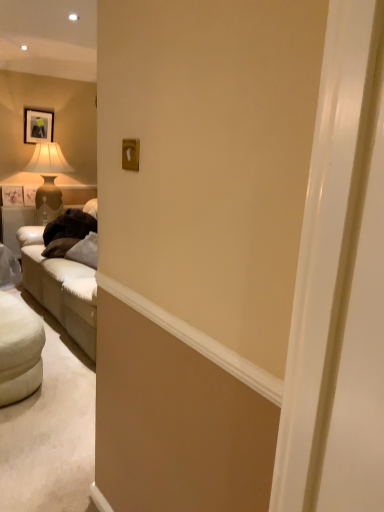
The width and height of the screenshot is (384, 512). What do you see at coordinates (48, 180) in the screenshot?
I see `matte beige lampshade at left` at bounding box center [48, 180].

Describe the element at coordinates (38, 125) in the screenshot. The height and width of the screenshot is (512, 384). I see `matte black picture frame at upper left` at that location.

Where is `matte beige lampshade at left`? matte beige lampshade at left is located at coordinates (48, 180).

Would you say matte black picture frame at upper left is a long distance from white fabric ottoman at lower left?

matte black picture frame at upper left is far away from white fabric ottoman at lower left.

Considering the positions of objects matte black picture frame at upper left and white fabric ottoman at lower left in the image provided, who is more to the left, matte black picture frame at upper left or white fabric ottoman at lower left?

Positioned to the left is matte black picture frame at upper left.

Can you confirm if matte black picture frame at upper left is thinner than white fabric ottoman at lower left?

Correct, the width of matte black picture frame at upper left is less than that of white fabric ottoman at lower left.

Looking at this image, from their relative heights in the image, would you say matte black picture frame at upper left is taller or shorter than white fabric ottoman at lower left?

Considering their sizes, matte black picture frame at upper left has more height than white fabric ottoman at lower left.

From a real-world perspective, between matte beige lampshade at left and white fabric ottoman at lower left, who is vertically lower?

In real-world perspective, white fabric ottoman at lower left is lower.

This screenshot has height=512, width=384. In order to click on table lamp above the white fabric ottoman at lower left (from a real-world perspective) in this screenshot , I will do `click(48, 180)`.

Consider the image. Considering the sizes of matte beige lampshade at left and white fabric ottoman at lower left in the image, is matte beige lampshade at left bigger or smaller than white fabric ottoman at lower left?

Considering their sizes, matte beige lampshade at left takes up more space than white fabric ottoman at lower left.

Is matte beige lampshade at left oriented towards white fabric ottoman at lower left?

No, matte beige lampshade at left is not facing towards white fabric ottoman at lower left.

Which is correct: white fabric ottoman at lower left is inside matte black picture frame at upper left, or outside of it?

white fabric ottoman at lower left lies outside matte black picture frame at upper left.

Based on their positions, is white fabric ottoman at lower left located to the left or right of matte black picture frame at upper left?

Clearly, white fabric ottoman at lower left is on the right of matte black picture frame at upper left in the image.

Does white fabric ottoman at lower left turn towards matte black picture frame at upper left?

No, white fabric ottoman at lower left is not aimed at matte black picture frame at upper left.

In the image, is white fabric ottoman at lower left positioned in front of or behind matte black picture frame at upper left?

In the image, white fabric ottoman at lower left appears in front of matte black picture frame at upper left.

Find the location of `table lamp located below the matte black picture frame at upper left (from the image's perspective)`. table lamp located below the matte black picture frame at upper left (from the image's perspective) is located at coordinates (48, 180).

Which of these two, matte black picture frame at upper left or matte beige lampshade at left, stands shorter?

matte black picture frame at upper left is shorter.

Measure the distance from matte black picture frame at upper left to matte beige lampshade at left.

matte black picture frame at upper left and matte beige lampshade at left are 18.85 inches apart from each other.

Which point is more distant from viewer, (57, 149) or (44, 112)?

The point (44, 112) is farther.

From a real-world perspective, is matte beige lampshade at left on top of matte black picture frame at upper left?

No.

Locate an element on the screen. picture frame behind the matte beige lampshade at left is located at coordinates (38, 125).

From the image's perspective, which one is positioned lower, matte beige lampshade at left or matte black picture frame at upper left?

matte beige lampshade at left is shown below in the image.

Between white fabric ottoman at lower left and matte beige lampshade at left, which one appears on the left side from the viewer's perspective?

Positioned to the left is matte beige lampshade at left.

From a real-world perspective, which is physically above, white fabric ottoman at lower left or matte beige lampshade at left?

matte beige lampshade at left.

Between white fabric ottoman at lower left and matte beige lampshade at left, which one has more height?

Standing taller between the two is matte beige lampshade at left.

Where is `picture frame above the white fabric ottoman at lower left (from the image's perspective)`? picture frame above the white fabric ottoman at lower left (from the image's perspective) is located at coordinates (38, 125).

Locate an element on the screen. This screenshot has width=384, height=512. table lamp behind the white fabric ottoman at lower left is located at coordinates (48, 180).

Consider the image. When comparing their distances from matte beige lampshade at left, does white fabric ottoman at lower left or matte black picture frame at upper left seem closer?

matte black picture frame at upper left.

Which object lies further to the anchor point matte beige lampshade at left, matte black picture frame at upper left or white fabric ottoman at lower left?

Based on the image, white fabric ottoman at lower left appears to be further to matte beige lampshade at left.

When comparing their distances from white fabric ottoman at lower left, does matte black picture frame at upper left or matte beige lampshade at left seem closer?

Based on the image, matte beige lampshade at left appears to be nearer to white fabric ottoman at lower left.

Based on their spatial positions, is white fabric ottoman at lower left or matte beige lampshade at left further from matte black picture frame at upper left?

white fabric ottoman at lower left is positioned further to the anchor matte black picture frame at upper left.

When comparing their distances from matte black picture frame at upper left, does matte beige lampshade at left or white fabric ottoman at lower left seem closer?

matte beige lampshade at left is closer to matte black picture frame at upper left.

When comparing their distances from white fabric ottoman at lower left, does matte beige lampshade at left or matte black picture frame at upper left seem closer?

matte beige lampshade at left is positioned closer to the anchor white fabric ottoman at lower left.

Where is `table lamp between white fabric ottoman at lower left and matte black picture frame at upper left in the front-back direction`? table lamp between white fabric ottoman at lower left and matte black picture frame at upper left in the front-back direction is located at coordinates (48, 180).